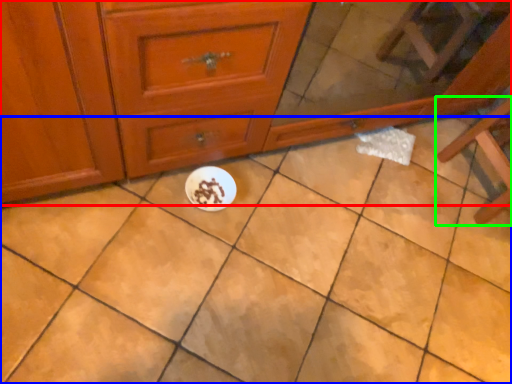
Question: Based on their relative distances, which object is nearer to chest of drawers (highlighted by a red box)? Choose from ceramic tile (highlighted by a blue box) and furniture (highlighted by a green box).

Choices:
 (A) ceramic tile
 (B) furniture

Answer: (A)